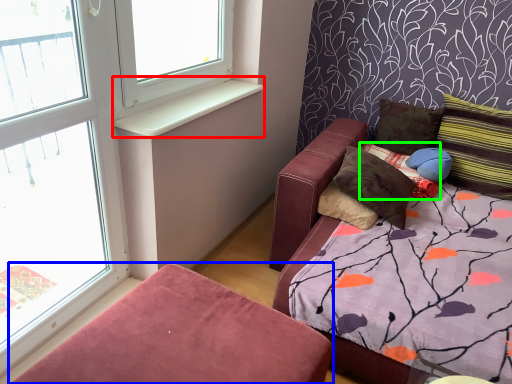
Question: Which object is positioned closest to window sill (highlighted by a red box)? Select from furniture (highlighted by a blue box) and pillow (highlighted by a green box).

Choices:
 (A) furniture
 (B) pillow

Answer: (A)